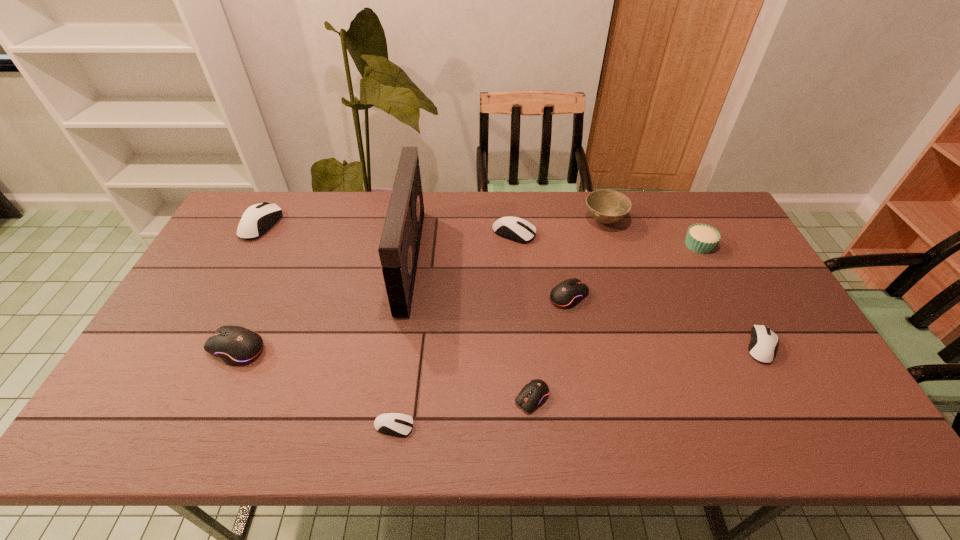
The height and width of the screenshot is (540, 960). What are the coordinates of `mouse that is at the right edge` in the screenshot? It's located at (763, 344).

You are a GUI agent. You are given a task and a screenshot of the screen. Output one action in this format:
    pyautogui.click(x=<x>, y=<y>)
    Task: Click on the object that is at the far left corner
    The image size is (960, 540).
    Given the screenshot: What is the action you would take?
    pyautogui.click(x=257, y=219)

In order to click on vacant region at the far edge in this screenshot , I will do `click(428, 210)`.

Where is `free space at the near edge`? free space at the near edge is located at coordinates (610, 436).

The height and width of the screenshot is (540, 960). What are the coordinates of `free space at the left edge` in the screenshot? It's located at (185, 358).

The width and height of the screenshot is (960, 540). In the image, there is a desktop. Identify the location of vacant space at the right edge. (798, 336).

Find the location of `unoccupied area between the cupcake and the biggest white mouse`. unoccupied area between the cupcake and the biggest white mouse is located at coordinates (480, 235).

Locate an element on the screen. The width and height of the screenshot is (960, 540). free spot between the biggest black computer mouse and the videotape is located at coordinates (324, 304).

Find the location of `empty location between the nearest object and the gray bowl`. empty location between the nearest object and the gray bowl is located at coordinates (499, 323).

At what (x,y) coordinates should I click in order to perform the action: click on empty space between the cupcake and the third farthest mouse. Please return your answer as a coordinate pair (x, y). The width and height of the screenshot is (960, 540). Looking at the image, I should click on (634, 271).